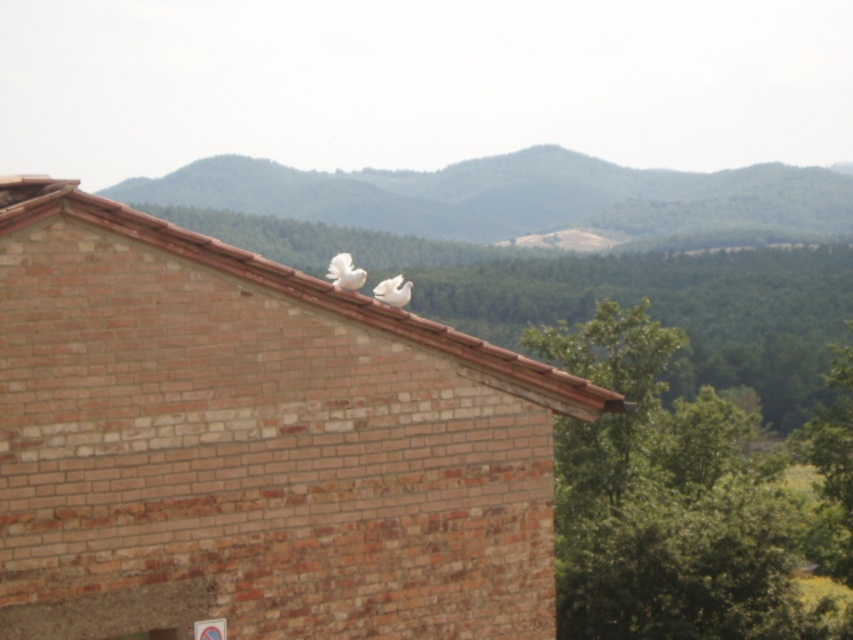
Can you confirm if brown tile roof at upper center is smaller than white feathered bird at center?

Actually, brown tile roof at upper center might be larger than white feathered bird at center.

Which is more to the right, brown tile roof at upper center or white feathered bird at center?

Positioned to the right is white feathered bird at center.

Is point (254, 280) farther from viewer compared to point (386, 292)?

No, (254, 280) is closer to viewer.

At what (x,y) coordinates should I click in order to perform the action: click on brown tile roof at upper center. Please return your answer as a coordinate pair (x, y). This screenshot has width=853, height=640. Looking at the image, I should click on (296, 288).